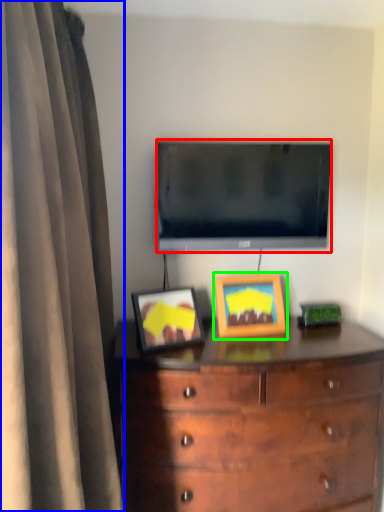
Question: Which object is positioned farthest from television (highlighted by a red box)? Select from curtain (highlighted by a blue box) and picture frame (highlighted by a green box).

Choices:
 (A) curtain
 (B) picture frame

Answer: (A)